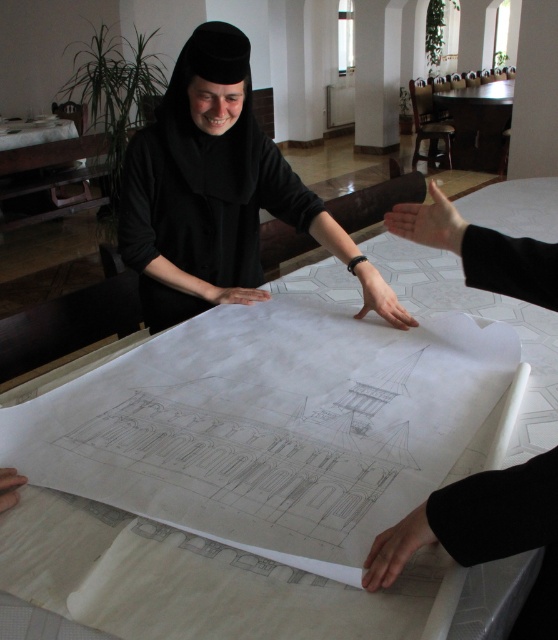
Question: Which object is closer to the camera taking this photo?

Choices:
 (A) black matte robe at lower right
 (B) black matte hand at center
 (C) black matte robe at center
 (D) wooden table at upper right

Answer: (A)

Question: Among these objects, which one is nearest to the camera?

Choices:
 (A) black matte robe at center
 (B) black matte robe at lower right

Answer: (B)

Question: Can you confirm if white paper at center is positioned above smooth skin hand at lower left?

Choices:
 (A) yes
 (B) no

Answer: (A)

Question: Which object is the farthest from the matte black hand at center?

Choices:
 (A) smooth skin hand at center
 (B) black matte robe at center

Answer: (A)

Question: Considering the relative positions of smooth skin hand at center and smooth skin hand at lower left in the image provided, where is smooth skin hand at center located with respect to smooth skin hand at lower left?

Choices:
 (A) right
 (B) left

Answer: (A)

Question: Is wooden table at upper right thinner than smooth skin hand at lower left?

Choices:
 (A) yes
 (B) no

Answer: (B)